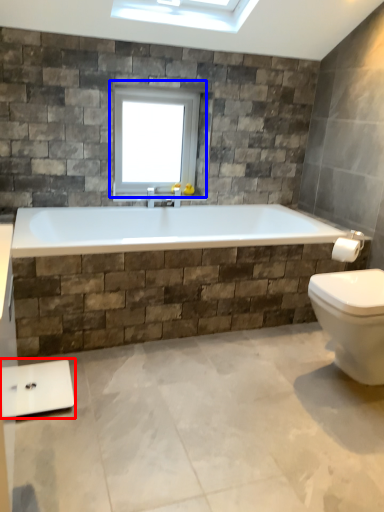
Question: Among these objects, which one is farthest to the camera, scale (highlighted by a red box) or window (highlighted by a blue box)?

Choices:
 (A) scale
 (B) window

Answer: (B)